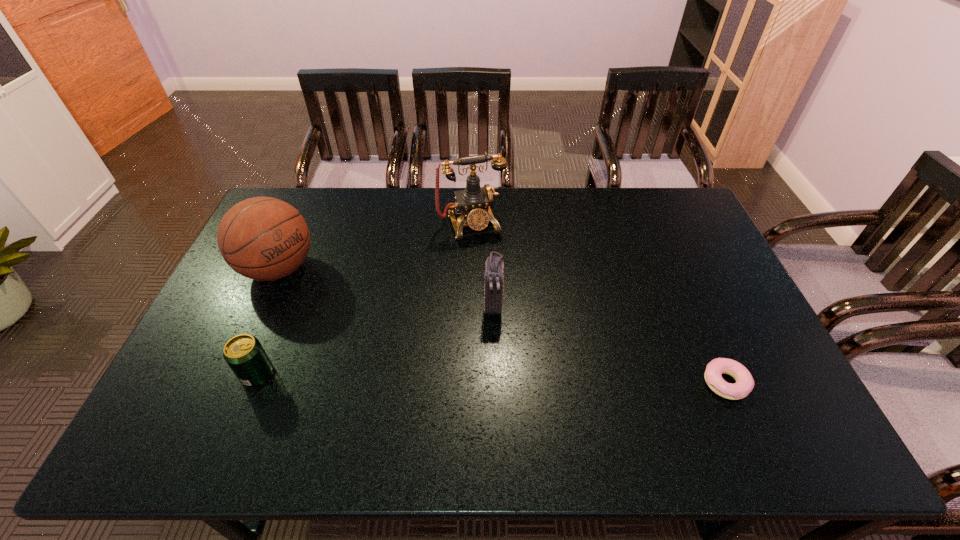
Where is `beer can`? This screenshot has width=960, height=540. beer can is located at coordinates (244, 354).

You are a GUI agent. You are given a task and a screenshot of the screen. Output one action in this format:
    pyautogui.click(x=<x>, y=<y>)
    Task: Click on the rightmost object
    The width and height of the screenshot is (960, 540).
    Given the screenshot: What is the action you would take?
    pyautogui.click(x=744, y=384)

At what (x,y) coordinates should I click in order to perform the action: click on doughnut. Please return your answer as a coordinate pair (x, y). Image resolution: width=960 pixels, height=540 pixels. Looking at the image, I should click on (744, 384).

Locate an element on the screen. The image size is (960, 540). basketball is located at coordinates (262, 238).

The width and height of the screenshot is (960, 540). In order to click on the third shortest object in this screenshot , I will do `click(493, 296)`.

At what (x,y) coordinates should I click in order to perform the action: click on telephone. Please return your answer as a coordinate pair (x, y). Image resolution: width=960 pixels, height=540 pixels. Looking at the image, I should click on (474, 202).

This screenshot has height=540, width=960. I want to click on free spot located on the right of the fourth tallest object, so click(x=332, y=374).

The height and width of the screenshot is (540, 960). I want to click on vacant region located 0.280m on the left of the shortest object, so click(x=591, y=383).

Where is `vacant area situated on the side with brand label of the basketball`? The width and height of the screenshot is (960, 540). vacant area situated on the side with brand label of the basketball is located at coordinates (388, 348).

Locate an element on the screen. The height and width of the screenshot is (540, 960). free space located on the side with brand label of the basketball is located at coordinates (353, 322).